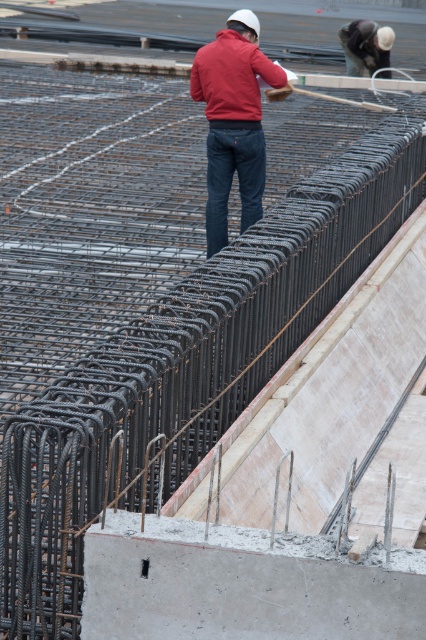
Is gray concrete at lower center smaller than matte red jacket at center?

Correct, gray concrete at lower center occupies less space than matte red jacket at center.

Can you confirm if gray concrete at lower center is positioned to the left of matte red jacket at center?

In fact, gray concrete at lower center is to the right of matte red jacket at center.

You are a GUI agent. You are given a task and a screenshot of the screen. Output one action in this format:
    pyautogui.click(x=<x>, y=<y>)
    Task: Click on the gray concrete at lower center
    The height and width of the screenshot is (640, 426).
    Given the screenshot: What is the action you would take?
    pyautogui.click(x=241, y=584)

What do you see at coordinates (241, 584) in the screenshot? Image resolution: width=426 pixels, height=640 pixels. I see `gray concrete at lower center` at bounding box center [241, 584].

Is gray concrete at lower center above matte white helmet at upper center?

No, gray concrete at lower center is not above matte white helmet at upper center.

Which is in front, point (173, 604) or point (359, 72)?

Point (173, 604) is more forward.

I want to click on gray concrete at lower center, so click(x=241, y=584).

Which is more to the left, red matte jacket at center or matte white helmet at upper center?

From the viewer's perspective, red matte jacket at center appears more on the left side.

Does red matte jacket at center have a greater height compared to matte white helmet at upper center?

Indeed, red matte jacket at center has a greater height compared to matte white helmet at upper center.

Image resolution: width=426 pixels, height=640 pixels. What do you see at coordinates (233, 120) in the screenshot?
I see `red matte jacket at center` at bounding box center [233, 120].

The width and height of the screenshot is (426, 640). I want to click on red matte jacket at center, so click(x=233, y=120).